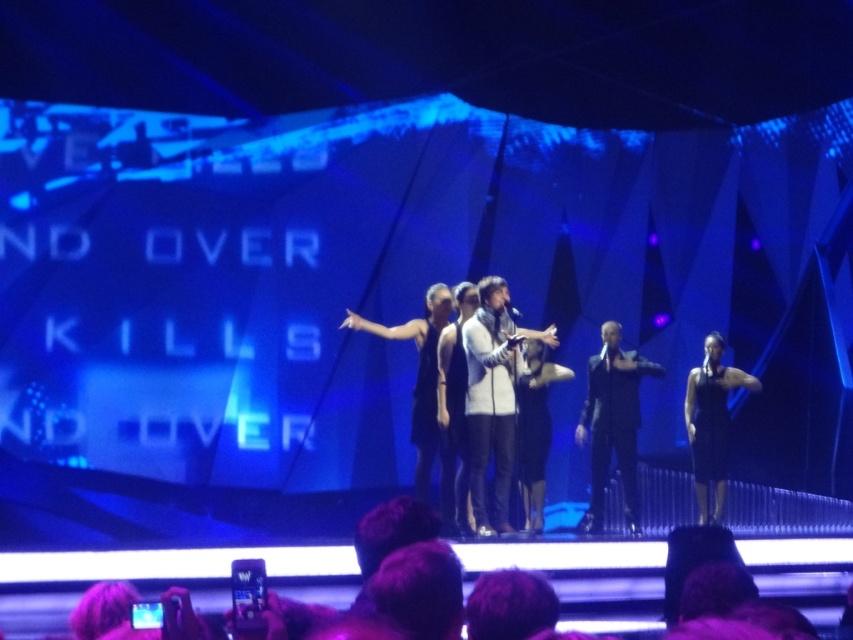
Question: Does black leather suit at center have a larger size compared to black satin dress at center?

Choices:
 (A) yes
 (B) no

Answer: (A)

Question: Does black leather suit at center appear on the left side of black satin dress at center?

Choices:
 (A) yes
 (B) no

Answer: (A)

Question: Does black leather suit at center have a smaller size compared to black satin dress at center?

Choices:
 (A) no
 (B) yes

Answer: (A)

Question: Which point is closer to the camera?

Choices:
 (A) (628, 372)
 (B) (706, 392)

Answer: (A)

Question: Among these points, which one is nearest to the camera?

Choices:
 (A) (581, 529)
 (B) (701, 365)

Answer: (A)

Question: Among these objects, which one is farthest from the camera?

Choices:
 (A) black leather suit at center
 (B) black satin dress at center

Answer: (B)